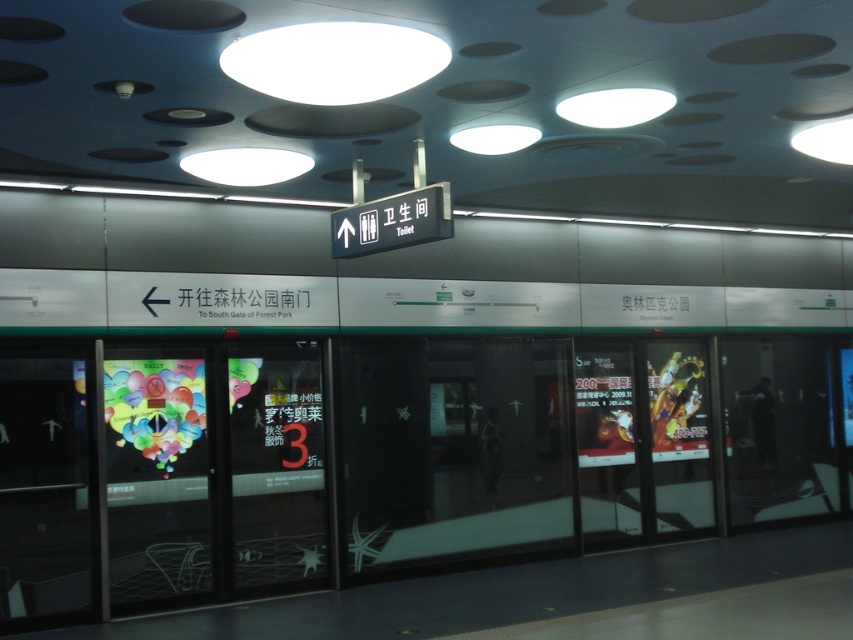
Looking at this image, you are a delivery person carrying a large package that is 1.5 meters wide. You need to enter the subway station through the doors. Which door should you choose between the transparent glass door at center and the translucent glass door at center to ensure your package fits through?

The transparent glass door at center has a greater width than the translucent glass door at center. Therefore, the transparent glass door at center is the better choice for the large 1.5 meter wide package.

You are a delivery person carrying a large package that is 1.5 meters wide. You need to enter the subway station through the doors. Can you fit through the space between the transparent glass door at center and the translucent glass door at center?

The distance between the transparent glass door at center and the translucent glass door at center is 1.33 meters. Since your package is 1.5 meters wide, it is wider than the available space, so you cannot fit through the doors.

You are a tourist in the subway station and want to exit through the doors. Which door should you push to exit? The transparent glass door at center or the translucent glass door at center?

The transparent glass door at center is above the translucent glass door at center. Since the transparent glass door at center is higher up, it is likely the exit door designed for exiting, so you should push the transparent glass door at center to exit.